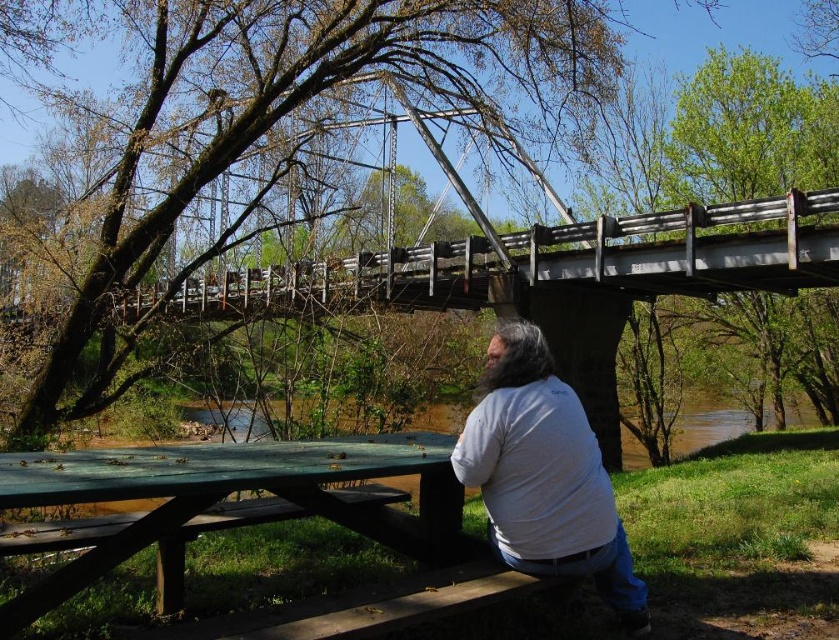
Is white matte shirt at lower center above wooden bench at lower center?

Correct, white matte shirt at lower center is located above wooden bench at lower center.

Does white matte shirt at lower center have a greater height compared to wooden bench at lower center?

Indeed, white matte shirt at lower center has a greater height compared to wooden bench at lower center.

Does point (504, 540) come behind point (468, 580)?

Yes, it is behind point (468, 580).

The height and width of the screenshot is (640, 839). I want to click on white matte shirt at lower center, so click(545, 474).

What do you see at coordinates (227, 496) in the screenshot? The image size is (839, 640). I see `green wood picnic table at lower center` at bounding box center [227, 496].

Is green wood picnic table at lower center wider than wooden bench at lower center?

Indeed, green wood picnic table at lower center has a greater width compared to wooden bench at lower center.

The height and width of the screenshot is (640, 839). I want to click on green wood picnic table at lower center, so click(227, 496).

Image resolution: width=839 pixels, height=640 pixels. I want to click on green wood picnic table at lower center, so click(227, 496).

Between point (90, 476) and point (524, 388), which one is positioned in front?

Point (90, 476) is in front.

Is green wood picnic table at lower center bigger than white matte shirt at lower center?

Correct, green wood picnic table at lower center is larger in size than white matte shirt at lower center.

Identify the location of green wood picnic table at lower center. This screenshot has width=839, height=640. (227, 496).